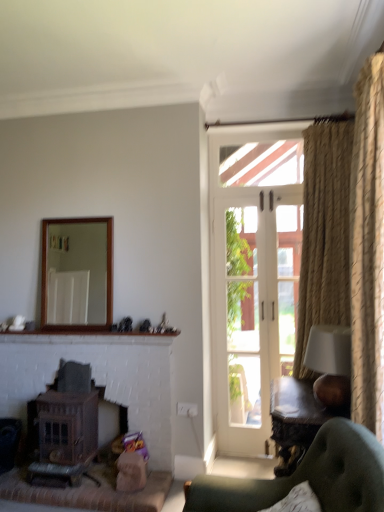
Where is `vacant area on top of wooden fireplace at lower left, the 1th fireplace when ordered from right to left (from a real-world perspective)`? Image resolution: width=384 pixels, height=512 pixels. vacant area on top of wooden fireplace at lower left, the 1th fireplace when ordered from right to left (from a real-world perspective) is located at coordinates (96, 350).